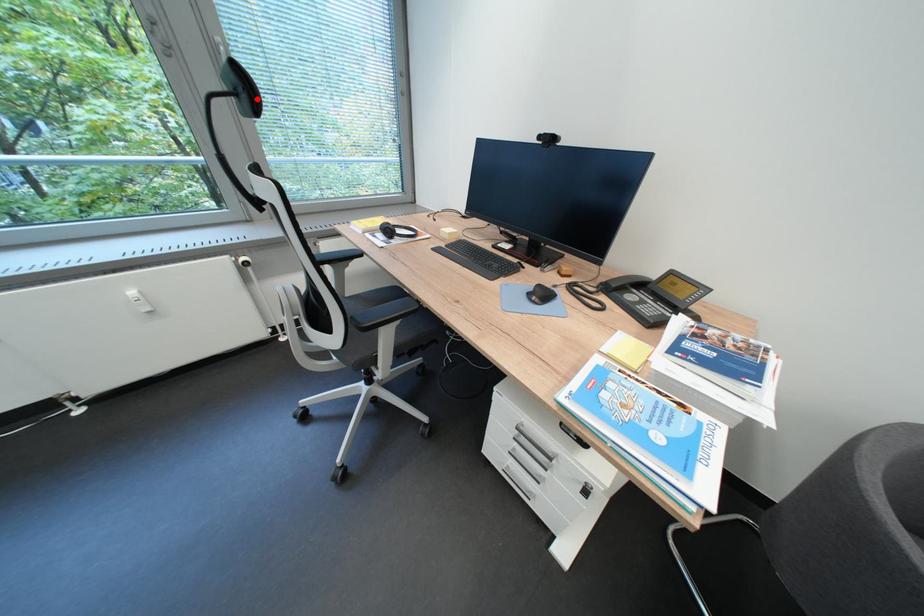
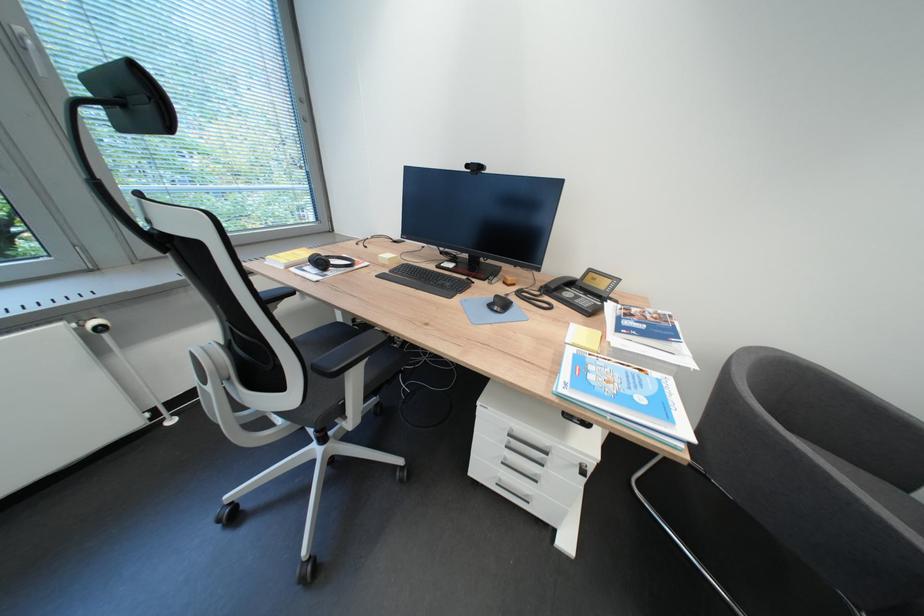
In the second image, find the point that corresponds to the highlighted location in the first image.

(160, 110)